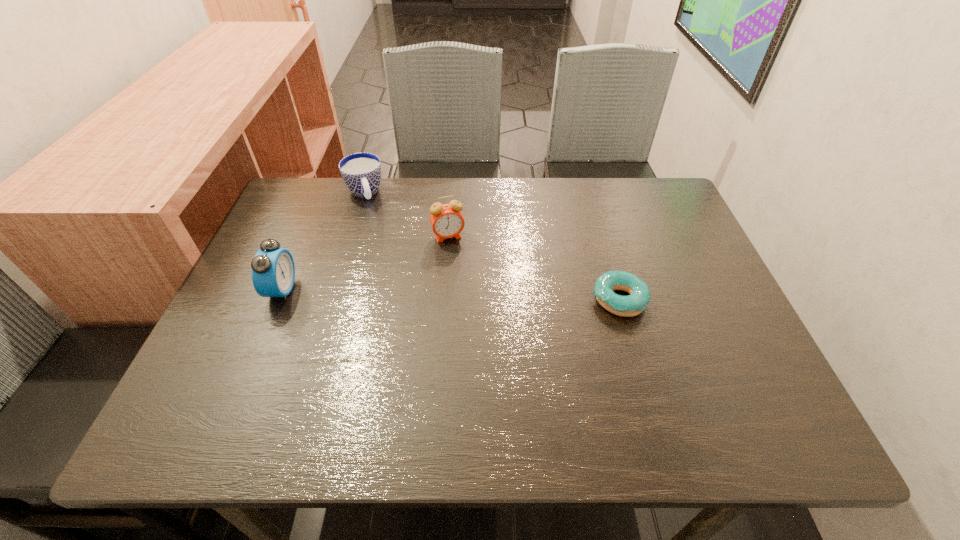
At what (x,y) coordinates should I click in order to perform the action: click on vacant point located between the shortest object and the third nearest object. Please return your answer as a coordinate pair (x, y). The width and height of the screenshot is (960, 540). Looking at the image, I should click on (534, 268).

This screenshot has height=540, width=960. In order to click on vacant space in between the doughnut and the second shortest object in this screenshot , I will do `click(492, 246)`.

Locate an element on the screen. Image resolution: width=960 pixels, height=540 pixels. free space between the leftmost object and the shortest object is located at coordinates (450, 295).

Locate an element on the screen. This screenshot has height=540, width=960. free spot between the nearer alarm clock and the second farthest object is located at coordinates (365, 263).

What are the coordinates of `free space that is in between the third object from right to left and the rightmost object` in the screenshot? It's located at (492, 246).

The width and height of the screenshot is (960, 540). I want to click on vacant space in between the leftmost object and the farther alarm clock, so click(x=365, y=263).

Image resolution: width=960 pixels, height=540 pixels. I want to click on vacant space in between the third nearest object and the doughnut, so click(x=534, y=268).

Find the location of a particular element. free spot between the shortest object and the cup is located at coordinates (492, 246).

The height and width of the screenshot is (540, 960). Identify the location of object that is the nearest to the farthest object. (447, 221).

At what (x,y) coordinates should I click in order to perform the action: click on object that ranks as the closest to the cup. Please return your answer as a coordinate pair (x, y). Looking at the image, I should click on (447, 221).